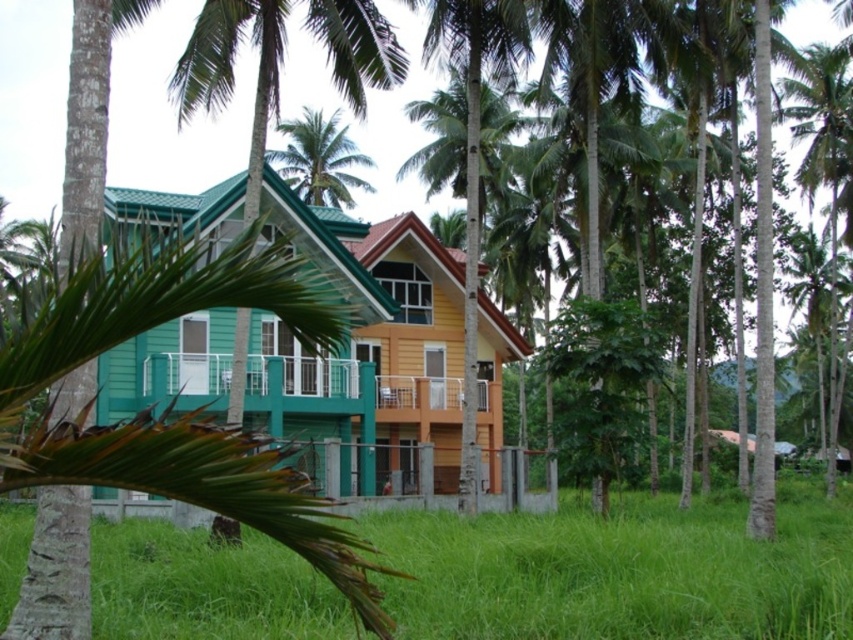
Question: Which of these objects is positioned farthest from the green grass at lower center?

Choices:
 (A) green leafy palm tree at upper center
 (B) green leafy palm tree at center

Answer: (A)

Question: Which object is positioned closest to the green leafy palm tree at center?

Choices:
 (A) green grass at lower center
 (B) green leafy palm tree at upper center

Answer: (A)

Question: Among these points, which one is nearest to the camera?

Choices:
 (A) (9, 545)
 (B) (512, 61)

Answer: (A)

Question: Can you confirm if green grass at lower center is smaller than green leafy palm tree at upper center?

Choices:
 (A) yes
 (B) no

Answer: (A)

Question: Considering the relative positions of green grass at lower center and green leafy palm tree at center in the image provided, where is green grass at lower center located with respect to green leafy palm tree at center?

Choices:
 (A) below
 (B) above

Answer: (A)

Question: Is green grass at lower center further to the viewer compared to green leafy palm tree at center?

Choices:
 (A) yes
 (B) no

Answer: (B)